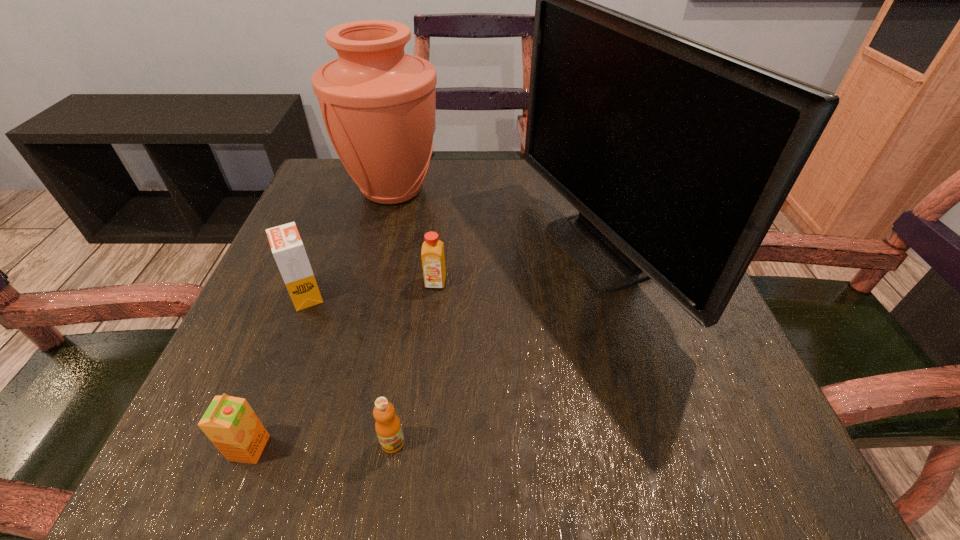
The width and height of the screenshot is (960, 540). What are the coordinates of `blank space at the left edge` in the screenshot? It's located at (265, 295).

Find the location of a particular element. The height and width of the screenshot is (540, 960). vacant area at the right edge of the desktop is located at coordinates (718, 366).

At what (x,y) coordinates should I click in order to perform the action: click on free space at the near left corner. Please return your answer as a coordinate pair (x, y). The image size is (960, 540). Looking at the image, I should click on point(206,457).

Where is `vacant space that's between the second orange juice from right to left and the rightmost orange juice`? vacant space that's between the second orange juice from right to left and the rightmost orange juice is located at coordinates (414, 362).

In order to click on free space between the rightmost orange juice and the tallest orange juice in this screenshot , I will do `click(371, 288)`.

Find the location of a particular element. vacant area between the third orange juice from left to right and the third tallest object is located at coordinates pyautogui.click(x=349, y=368).

Locate an element on the screen. The height and width of the screenshot is (540, 960). free space between the fourth shortest object and the third orange juice from left to right is located at coordinates (349, 368).

Locate an element on the screen. Image resolution: width=960 pixels, height=540 pixels. free space between the tallest orange juice and the third orange juice from left to right is located at coordinates (349, 368).

Find the location of a particular element. Image resolution: width=960 pixels, height=540 pixels. vacant space that is in between the third orange juice from left to right and the fourth shortest object is located at coordinates (349, 368).

Locate an element on the screen. The width and height of the screenshot is (960, 540). vacant space in between the fourth shortest object and the third orange juice from left to right is located at coordinates (349, 368).